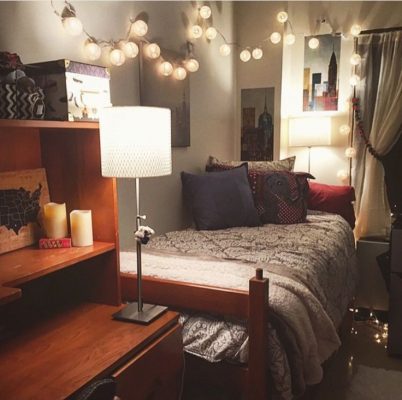
You are a GUI agent. You are given a task and a screenshot of the screen. Output one action in this format:
    pyautogui.click(x=<x>, y=<y>)
    Task: Click on the lights
    
    Given the screenshot: What is the action you would take?
    pyautogui.click(x=119, y=59)